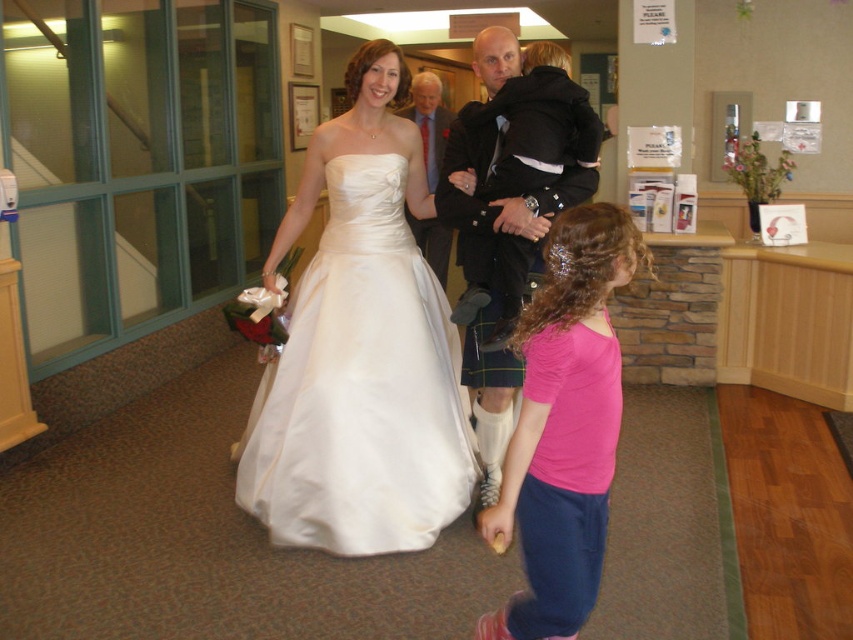
In the scene shown: Is pink fabric shirt at center below pink satin dress at lower right?

Actually, pink fabric shirt at center is above pink satin dress at lower right.

Measure the distance between point (595,566) and camera.

The distance of point (595,566) from camera is 6.10 feet.

The image size is (853, 640). Find the location of `pink fabric shirt at center`. pink fabric shirt at center is located at coordinates (564, 426).

Is pink satin dress at lower right above matte white dress at center?

No.

Is pink satin dress at lower right wider than matte white dress at center?

No.

Who is more distant from viewer, [554,346] or [433,145]?

The point [433,145] is more distant.

Where is `pink satin dress at lower right`? This screenshot has height=640, width=853. pink satin dress at lower right is located at coordinates (566, 477).

The image size is (853, 640). Describe the element at coordinates (361, 348) in the screenshot. I see `white satin dress at center` at that location.

Is white satin dress at center thinner than black kilt at center?

No.

Who is more forward, (404, 292) or (474, 65)?

Point (404, 292) is in front.

Identify the location of white satin dress at center. Image resolution: width=853 pixels, height=640 pixels. (361, 348).